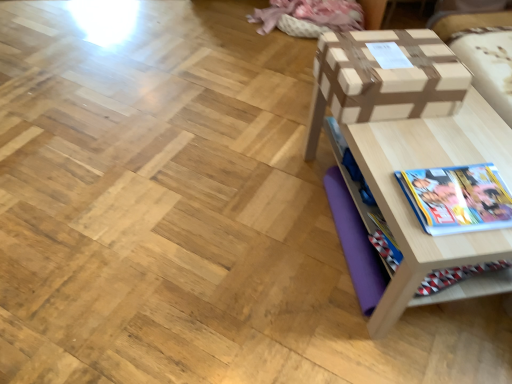
Image resolution: width=512 pixels, height=384 pixels. I want to click on vacant space to the left of hardcover book at lower right, so click(389, 183).